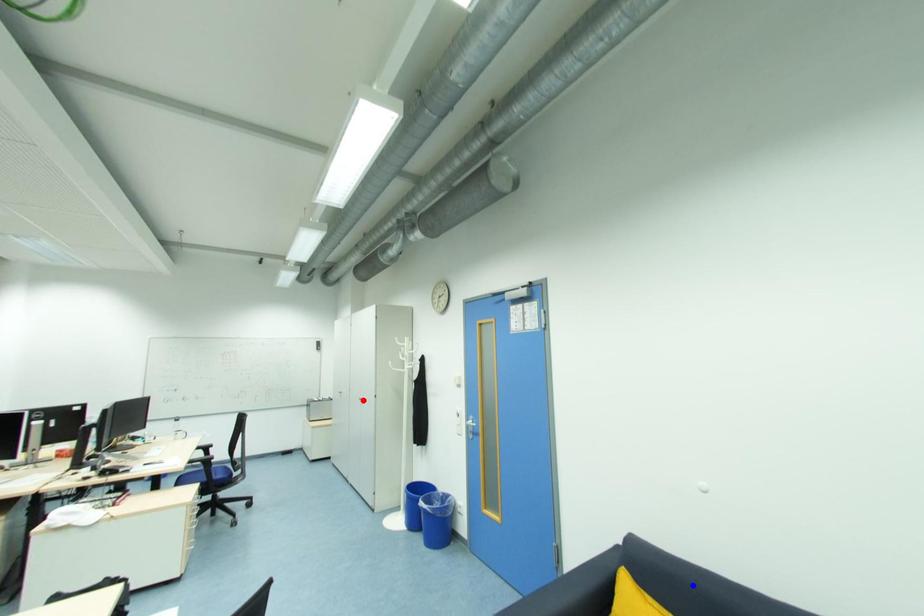
Question: In the image, two points are highlighted. Which point is nearer to the camera? Reply with the corresponding letter.

Choices:
 (A) blue point
 (B) red point

Answer: (A)